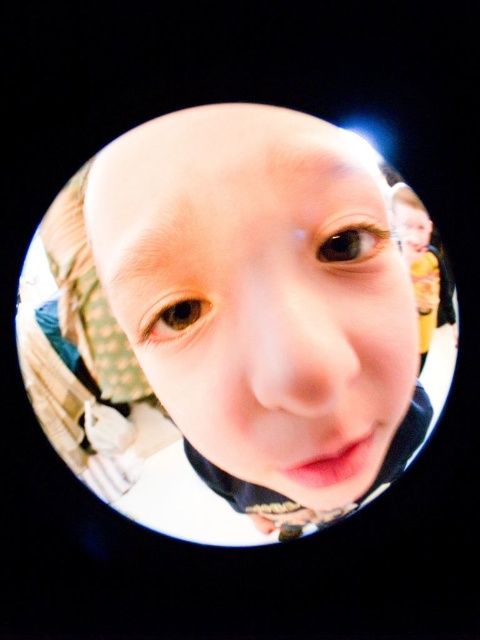
Who is taller, smooth skin face at center or smooth yellow shirt at right?

smooth skin face at center

Can you confirm if smooth skin face at center is positioned to the right of smooth yellow shirt at right?

In fact, smooth skin face at center is to the left of smooth yellow shirt at right.

Is point (203, 289) positioned in front of point (411, 220)?

Yes, point (203, 289) is in front of point (411, 220).

Find the location of a particular element. The image size is (480, 640). smooth skin face at center is located at coordinates (265, 314).